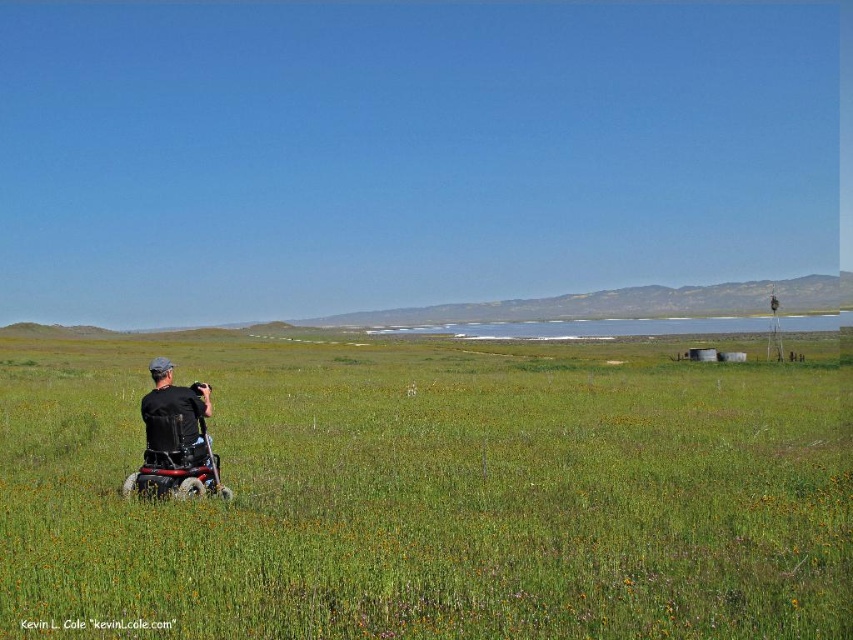
Question: Is green grassy field at center below black plastic wheelchair at lower left?

Choices:
 (A) yes
 (B) no

Answer: (A)

Question: Which object appears farthest from the camera in this image?

Choices:
 (A) green grassy field at center
 (B) black matte wheelchair at lower left
 (C) black plastic wheelchair at lower left

Answer: (B)

Question: Which of these objects is positioned closest to the black matte wheelchair at lower left?

Choices:
 (A) green grassy field at center
 (B) black plastic wheelchair at lower left

Answer: (B)

Question: Can you confirm if green grassy field at center is bigger than black matte wheelchair at lower left?

Choices:
 (A) no
 (B) yes

Answer: (B)

Question: Does black plastic wheelchair at lower left have a lesser width compared to black matte wheelchair at lower left?

Choices:
 (A) no
 (B) yes

Answer: (B)

Question: Which point is closer to the camera?

Choices:
 (A) (202, 477)
 (B) (59, 564)

Answer: (B)